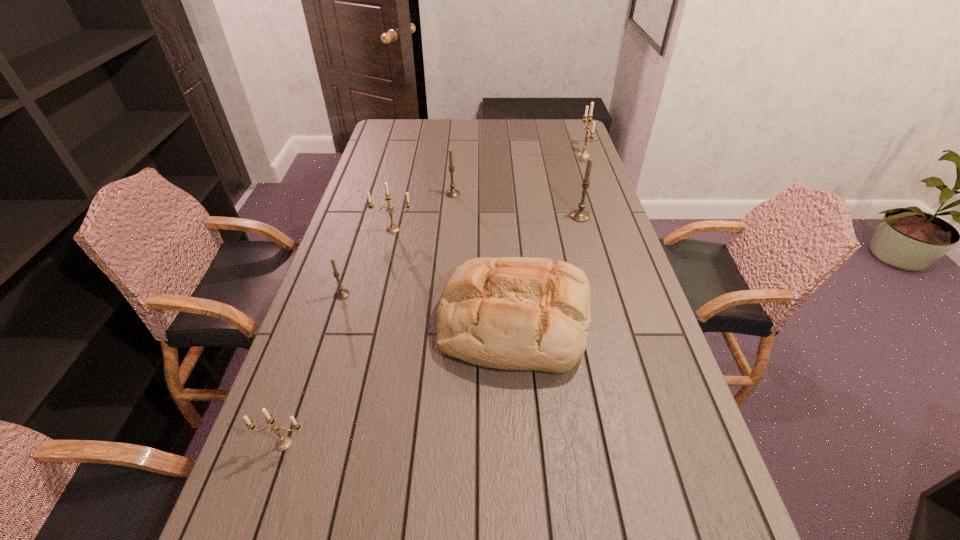
Locate an element on the screen. This screenshot has width=960, height=540. object that ranks as the fourth closest to the second nearest gray candle is located at coordinates pos(393,228).

Locate an element on the screen. The image size is (960, 540). object that is the third closest one to the leftmost gray candle is located at coordinates (284, 443).

Find the location of a particular element. candle that is the third closest to the third farthest object is located at coordinates (x=393, y=228).

Locate an element on the screen. The height and width of the screenshot is (540, 960). candle that is the second closest to the fourth nearest object is located at coordinates (342, 293).

Locate an element on the screen. The image size is (960, 540). metallic candle that is the closest to the second farthest metallic candle is located at coordinates (284, 443).

Find the location of `the second closest metallic candle relative to the bread`. the second closest metallic candle relative to the bread is located at coordinates (284, 443).

The height and width of the screenshot is (540, 960). Identify the location of gray candle object that ranks as the second closest to the third candle from right to left. (342, 293).

Image resolution: width=960 pixels, height=540 pixels. I want to click on gray candle that is the second closest to the bread, so click(x=580, y=215).